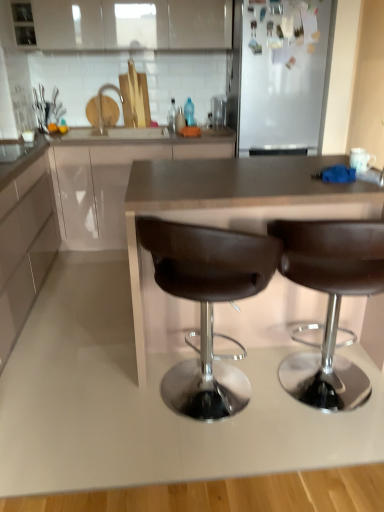
Question: From the image's perspective, would you say matte white cabinet at center, placed as the 2th cabinetry when sorted from top to bottom, is positioned over brown leather countertop at center?

Choices:
 (A) yes
 (B) no

Answer: (A)

Question: Is matte white cabinet at center, placed as the 2th cabinetry when sorted from top to bottom, facing towards brown leather countertop at center?

Choices:
 (A) no
 (B) yes

Answer: (B)

Question: Would you consider matte white cabinet at center, placed as the 2th cabinetry when sorted from top to bottom, to be distant from brown leather countertop at center?

Choices:
 (A) yes
 (B) no

Answer: (B)

Question: Is the position of matte white cabinet at center, positioned as the 2th cabinetry in bottom-to-top order, more distant than that of brown leather countertop at center?

Choices:
 (A) yes
 (B) no

Answer: (A)

Question: Does matte white cabinet at center, positioned as the 2th cabinetry in bottom-to-top order, have a lesser width compared to brown leather countertop at center?

Choices:
 (A) no
 (B) yes

Answer: (A)

Question: Does point (112, 35) appear closer or farther from the camera than point (152, 249)?

Choices:
 (A) closer
 (B) farther

Answer: (B)

Question: In the image, is white glossy cabinet at upper center, arranged as the 3th cabinetry when ordered from the bottom, on the left side or the right side of brown leather stool at center, the 2th chair when ordered from right to left?

Choices:
 (A) left
 (B) right

Answer: (A)

Question: From a real-world perspective, is white glossy cabinet at upper center, arranged as the 3th cabinetry when ordered from the bottom, above or below brown leather stool at center, the 2th chair when ordered from right to left?

Choices:
 (A) below
 (B) above

Answer: (B)

Question: Looking at the image, does white glossy cabinet at upper center, which is the first cabinetry in top-to-bottom order, seem bigger or smaller compared to brown leather stool at center, the first chair when ordered from left to right?

Choices:
 (A) small
 (B) big

Answer: (A)

Question: From the image's perspective, is brown leather countertop at center above or below brown leather stool at center, acting as the 2th chair starting from the left?

Choices:
 (A) above
 (B) below

Answer: (A)

Question: Considering their positions, is brown leather countertop at center located in front of or behind brown leather stool at center, the first chair from the right?

Choices:
 (A) behind
 (B) front

Answer: (A)

Question: In terms of size, does brown leather countertop at center appear bigger or smaller than brown leather stool at center, the first chair from the right?

Choices:
 (A) small
 (B) big

Answer: (B)

Question: Would you say brown leather countertop at center is inside or outside brown leather stool at center, the first chair from the right?

Choices:
 (A) outside
 (B) inside

Answer: (A)

Question: Is white glossy cabinet at upper center, arranged as the 3th cabinetry when ordered from the bottom, bigger or smaller than matte white cabinet at center, placed as the 2th cabinetry when sorted from top to bottom?

Choices:
 (A) small
 (B) big

Answer: (A)

Question: Is point (196, 47) positioned closer to the camera than point (140, 129)?

Choices:
 (A) farther
 (B) closer

Answer: (B)